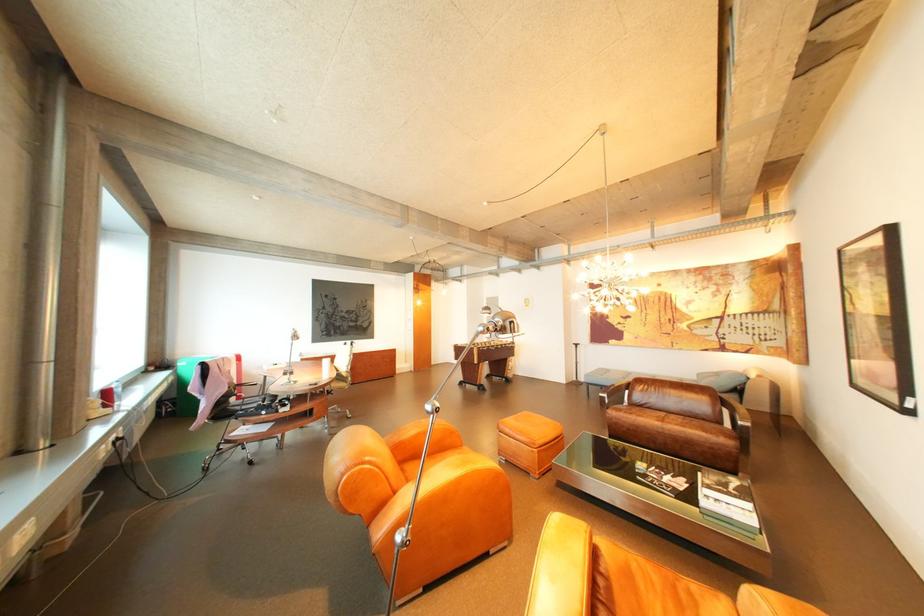
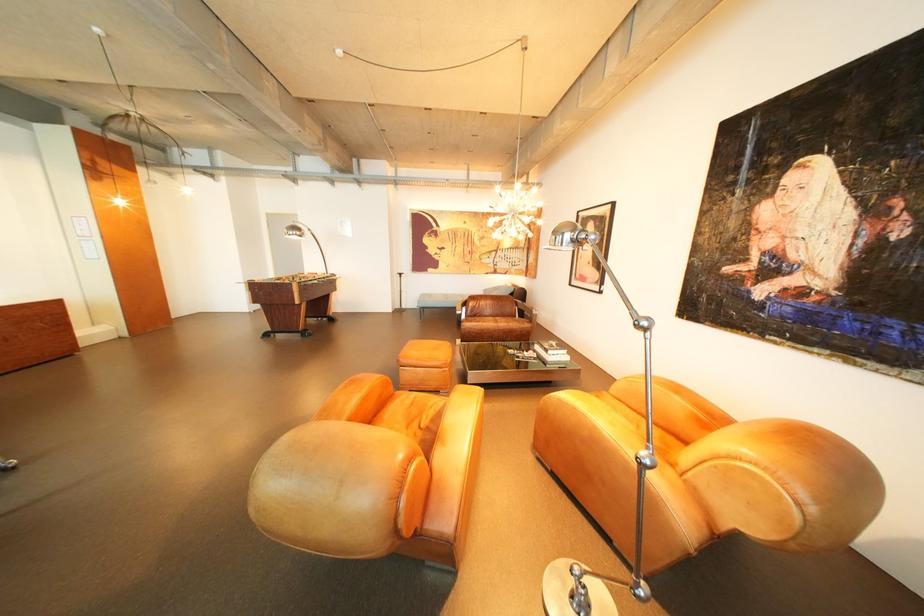
Locate, in the second image, the point that corresponds to the point at 675,419 in the first image.

(509, 322)